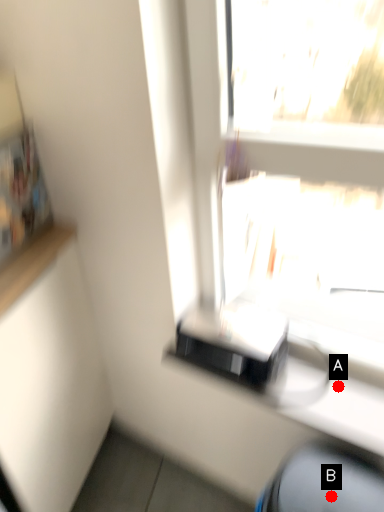
Question: Two points are circled on the image, labeled by A and B beside each circle. Which point is closer to the camera?

Choices:
 (A) A is closer
 (B) B is closer

Answer: (B)